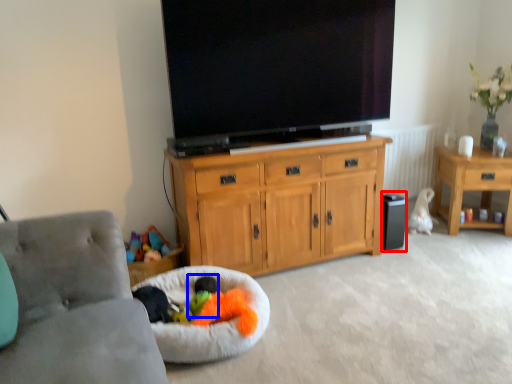
Question: Which point is closer to the camera, loudspeaker (highlighted by a red box) or toy (highlighted by a blue box)?

Choices:
 (A) loudspeaker
 (B) toy

Answer: (B)